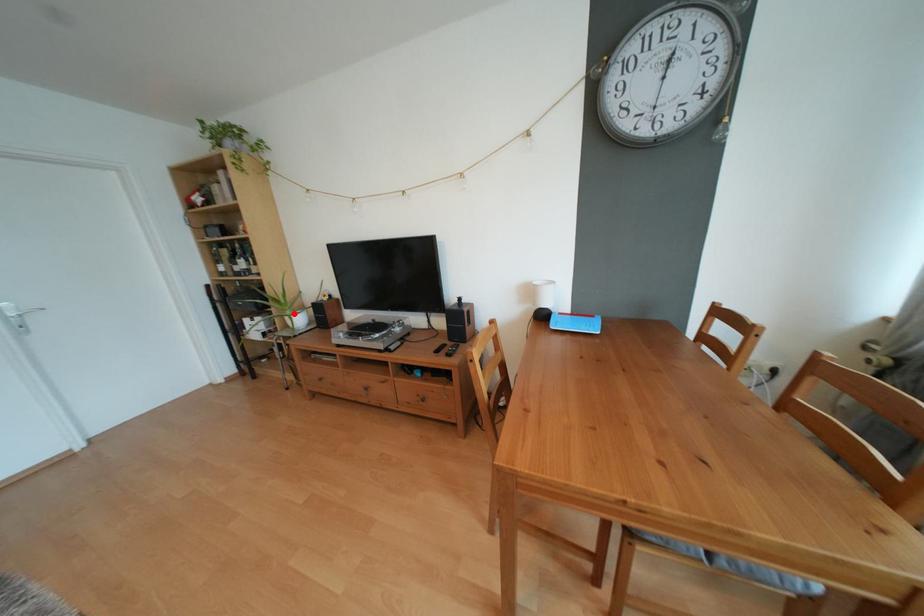
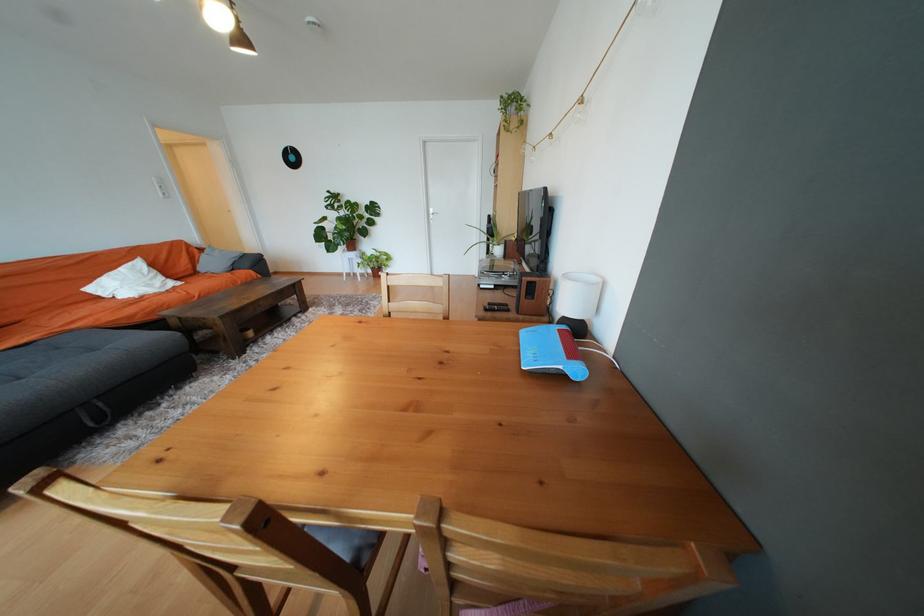
In the second image, find the point that corresponds to the highlighted location in the first image.

(502, 244)